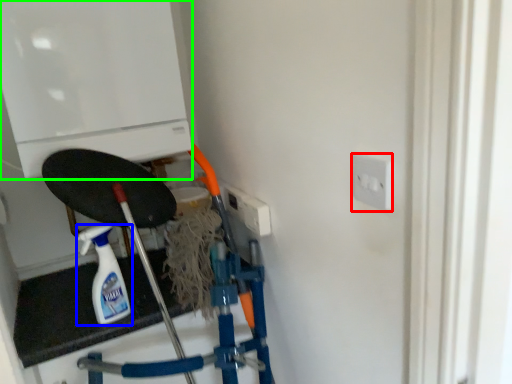
Question: Which object is the closest to the socket (highlighted by a red box)? Choose among these: bottle (highlighted by a blue box) or appliance (highlighted by a green box).

Choices:
 (A) bottle
 (B) appliance

Answer: (B)